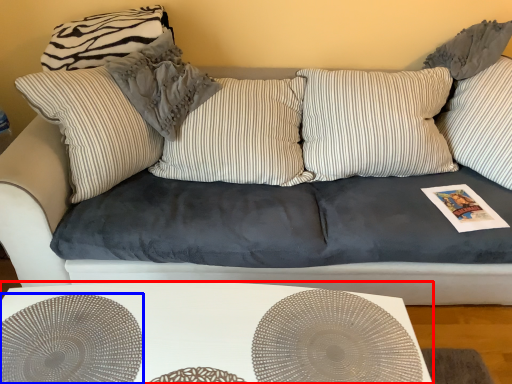
Question: Which object appears closest to the camera in this image, table (highlighted by a red box) or circle (highlighted by a blue box)?

Choices:
 (A) table
 (B) circle

Answer: (B)